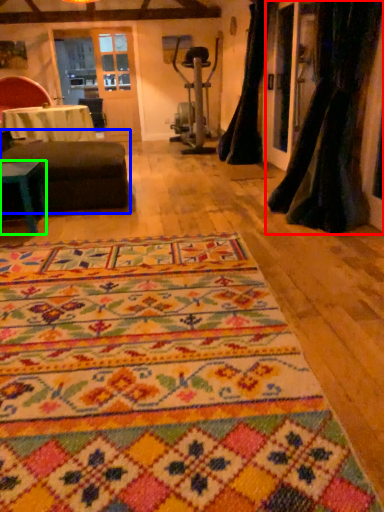
Question: Which object is positioned farthest from curtain (highlighted by a red box)? Select from studio couch (highlighted by a blue box) and table (highlighted by a green box).

Choices:
 (A) studio couch
 (B) table

Answer: (B)